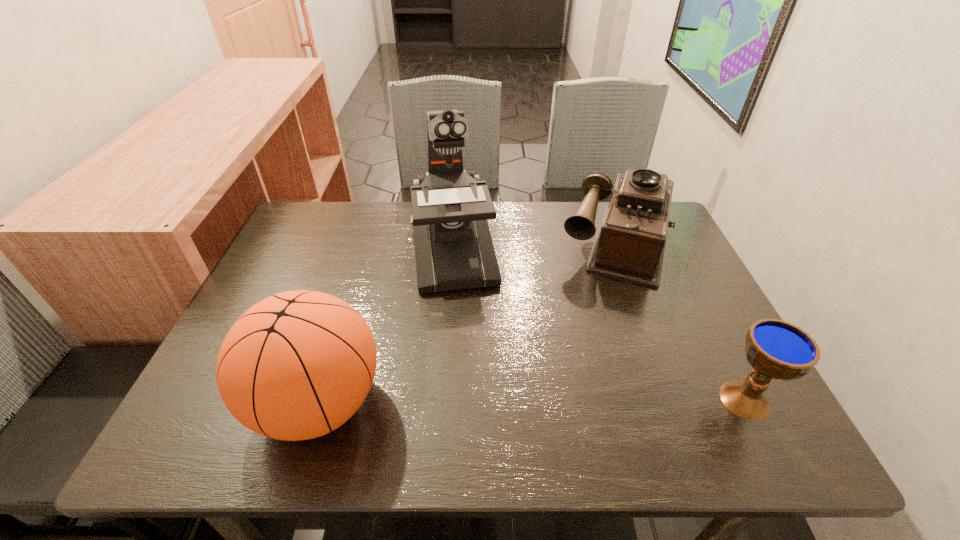
Image resolution: width=960 pixels, height=540 pixels. What are the coordinates of `free space that is in between the basketball and the phonograph_record` in the screenshot? It's located at (468, 322).

The image size is (960, 540). I want to click on empty location between the second tallest object and the phonograph_record, so click(468, 322).

Locate an element on the screen. Image resolution: width=960 pixels, height=540 pixels. free space between the chalice and the basketball is located at coordinates (532, 401).

Locate an element on the screen. The height and width of the screenshot is (540, 960). vacant area between the phonograph_record and the microscope is located at coordinates (536, 246).

The height and width of the screenshot is (540, 960). Find the location of `empty location between the tallest object and the phonograph_record`. empty location between the tallest object and the phonograph_record is located at coordinates (536, 246).

Locate an element on the screen. free point between the phonograph_record and the microscope is located at coordinates (536, 246).

Select which object is the third closest to the tallest object. Please provide its 2D coordinates. Your answer should be formatted as a tuple, i.e. [(x, y)], where the tuple contains the x and y coordinates of a point satisfying the conditions above.

[(776, 349)]

Point out which object is positioned as the second nearest to the basketball. Please provide its 2D coordinates. Your answer should be formatted as a tuple, i.e. [(x, y)], where the tuple contains the x and y coordinates of a point satisfying the conditions above.

[(630, 242)]

What are the coordinates of `vacant area that satisfies the following two spatial constraints: 1. on the back side of the chalice; 2. on the left side of the basketball` in the screenshot? It's located at (319, 400).

This screenshot has height=540, width=960. I want to click on blank area in the image that satisfies the following two spatial constraints: 1. on the back side of the third shortest object; 2. on the right side of the tallest object, so click(x=366, y=250).